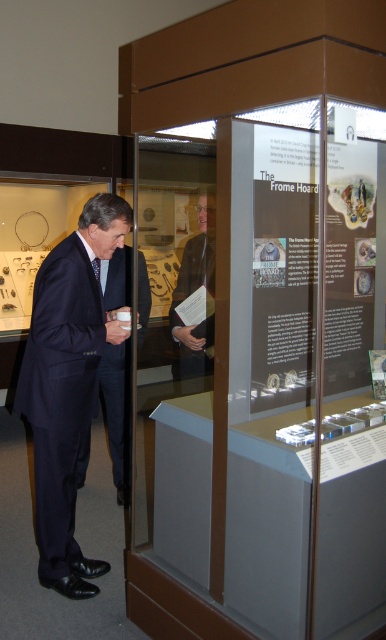
Question: Which point is farther to the camera?

Choices:
 (A) (54, 458)
 (B) (201, 209)

Answer: (B)

Question: Does navy blue suit at left appear under matte brown jacket at center?

Choices:
 (A) no
 (B) yes

Answer: (B)

Question: Is navy blue suit at left behind matte brown jacket at center?

Choices:
 (A) yes
 (B) no

Answer: (B)

Question: Can you confirm if navy blue suit at left is thinner than matte brown jacket at center?

Choices:
 (A) no
 (B) yes

Answer: (A)